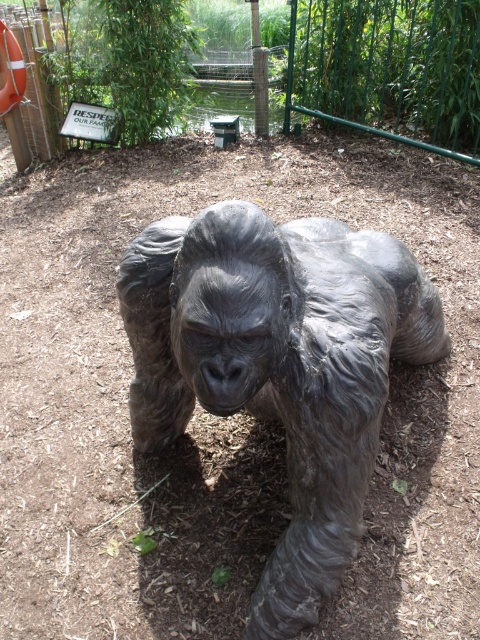
You are a photographer trying to capture a clear shot of the bronze statue at center without the green metal fence at upper center appearing in the background. Is this possible based on their positions?

The bronze statue at center is in front of the green metal fence at upper center, so it will block the fence from view. Therefore, you can take a clear shot of the bronze statue at center without the green metal fence at upper center in the background.

You are a zookeeper planning to clean the area around the bronze statue at center. The cleaning equipment is placed near the green metal fence at upper center. To reach the equipment, do you need to go around the statue or can you walk directly to it?

The bronze statue at center is positioned under the green metal fence at upper center, so the green metal fence at upper center is above the statue. Therefore, you can walk directly to the equipment near the green metal fence at upper center without needing to go around the bronze statue at center.